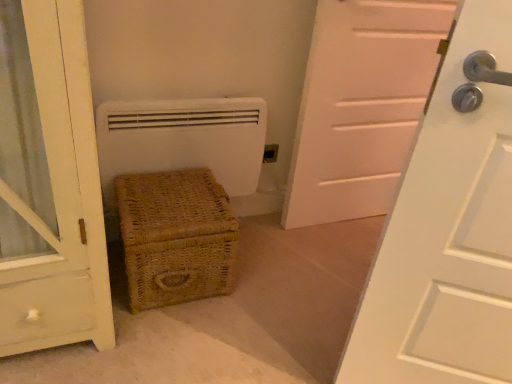
Question: Does white matte door at center have a greater width compared to woven brown basket at lower left?

Choices:
 (A) no
 (B) yes

Answer: (A)

Question: Is white matte door at center behind woven brown basket at lower left?

Choices:
 (A) yes
 (B) no

Answer: (A)

Question: Is white matte door at center far from woven brown basket at lower left?

Choices:
 (A) yes
 (B) no

Answer: (B)

Question: Can woven brown basket at lower left be found inside white matte door at center?

Choices:
 (A) no
 (B) yes

Answer: (A)

Question: Does white matte door at center have a larger size compared to woven brown basket at lower left?

Choices:
 (A) no
 (B) yes

Answer: (B)

Question: From a real-world perspective, is white matte door at center physically below woven brown basket at lower left?

Choices:
 (A) yes
 (B) no

Answer: (B)

Question: Does matte plastic electrical outlet at center appear on the left side of white matte heater at center?

Choices:
 (A) no
 (B) yes

Answer: (A)

Question: Can you confirm if matte plastic electrical outlet at center is taller than white matte heater at center?

Choices:
 (A) yes
 (B) no

Answer: (B)

Question: From a real-world perspective, is matte plastic electrical outlet at center positioned under white matte heater at center based on gravity?

Choices:
 (A) no
 (B) yes

Answer: (B)

Question: Are matte plastic electrical outlet at center and white matte heater at center making contact?

Choices:
 (A) no
 (B) yes

Answer: (A)

Question: From the image's perspective, is matte plastic electrical outlet at center beneath white matte heater at center?

Choices:
 (A) no
 (B) yes

Answer: (A)

Question: Can you confirm if matte plastic electrical outlet at center is shorter than white matte heater at center?

Choices:
 (A) yes
 (B) no

Answer: (A)

Question: From the image's perspective, would you say woven brown basket at lower left is positioned over white matte heater at center?

Choices:
 (A) no
 (B) yes

Answer: (A)